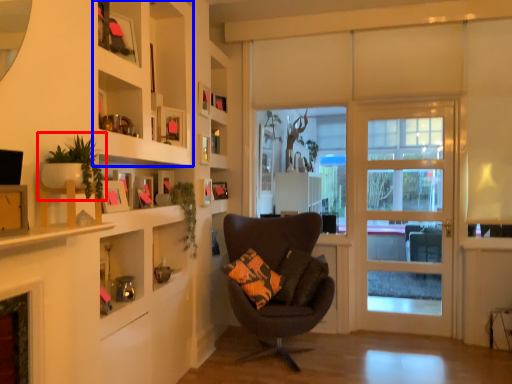
Question: Which of the following is the farthest to the observer, houseplant (highlighted by a red box) or cabinet (highlighted by a blue box)?

Choices:
 (A) houseplant
 (B) cabinet

Answer: (B)